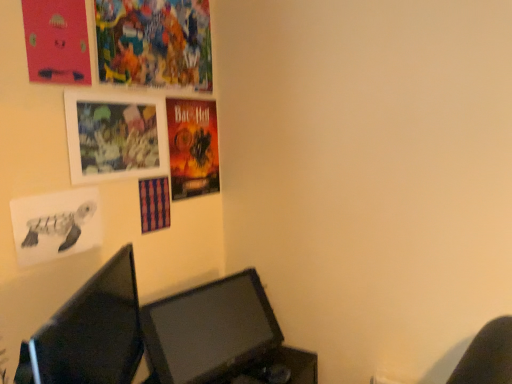
Question: Considering the relative sizes of shiny paper poster at upper center and matte black monitor at lower left, which is the second computer monitor from back to front, in the image provided, is shiny paper poster at upper center thinner than matte black monitor at lower left, which is the second computer monitor from back to front,?

Choices:
 (A) yes
 (B) no

Answer: (A)

Question: From a real-world perspective, is shiny paper poster at upper center on matte black monitor at lower left, which is the second computer monitor from back to front?

Choices:
 (A) no
 (B) yes

Answer: (B)

Question: Is shiny paper poster at upper center bigger than matte black monitor at lower left, which is the 1th computer monitor in front-to-back order?

Choices:
 (A) yes
 (B) no

Answer: (B)

Question: Is shiny paper poster at upper center to the left of matte black monitor at lower left, which is the 1th computer monitor in front-to-back order, from the viewer's perspective?

Choices:
 (A) yes
 (B) no

Answer: (B)

Question: Is shiny paper poster at upper center turned away from matte black monitor at lower left, which is the second computer monitor from back to front?

Choices:
 (A) no
 (B) yes

Answer: (A)

Question: From the image's perspective, does shiny paper poster at upper center appear lower than matte black monitor at lower left, which is the second computer monitor from back to front?

Choices:
 (A) yes
 (B) no

Answer: (B)

Question: Does matte black monitor at lower center, marked as the 2th computer monitor in a front-to-back arrangement, touch matte pink poster at upper left, which ranks as the 2th poster page in top-to-bottom order?

Choices:
 (A) no
 (B) yes

Answer: (A)

Question: Does matte black monitor at lower center, the first computer monitor in the back-to-front sequence, come behind matte pink poster at upper left, which ranks as the 2th poster page in top-to-bottom order?

Choices:
 (A) yes
 (B) no

Answer: (A)

Question: Is matte black monitor at lower center, marked as the 2th computer monitor in a front-to-back arrangement, bigger than matte pink poster at upper left, which ranks as the 2th poster page in top-to-bottom order?

Choices:
 (A) no
 (B) yes

Answer: (B)

Question: Can you confirm if matte black monitor at lower center, marked as the 2th computer monitor in a front-to-back arrangement, is thinner than matte pink poster at upper left, which ranks as the 2th poster page in top-to-bottom order?

Choices:
 (A) yes
 (B) no

Answer: (B)

Question: Does matte black monitor at lower center, the first computer monitor in the back-to-front sequence, appear on the right side of matte pink poster at upper left, which ranks as the 2th poster page in top-to-bottom order?

Choices:
 (A) yes
 (B) no

Answer: (A)

Question: Can you confirm if matte black monitor at lower center, marked as the 2th computer monitor in a front-to-back arrangement, is positioned to the left of matte pink poster at upper left, the 2th poster page positioned from the bottom?

Choices:
 (A) yes
 (B) no

Answer: (B)

Question: Can you confirm if vibrant paper poster at upper left, the first poster page in the top-to-bottom sequence, is thinner than matte pink poster at upper left, the 2th poster page positioned from the bottom?

Choices:
 (A) no
 (B) yes

Answer: (A)